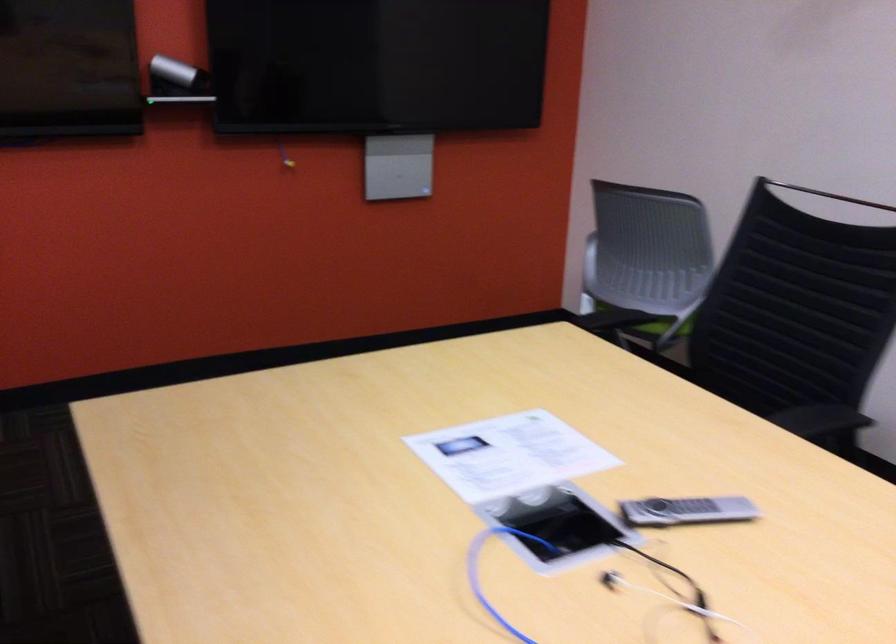
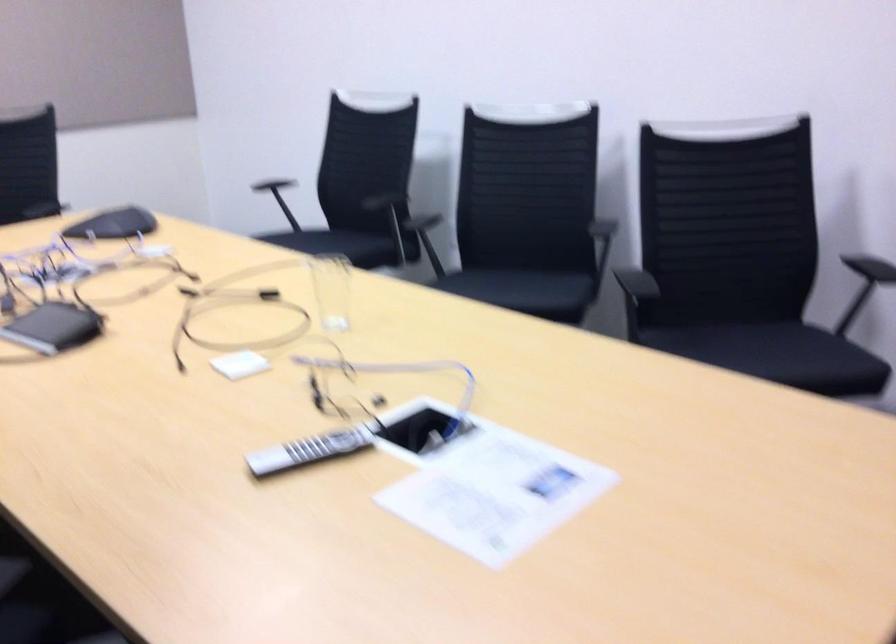
The point at (538, 576) is marked in the first image. Where is the corresponding point in the second image?

(419, 430)